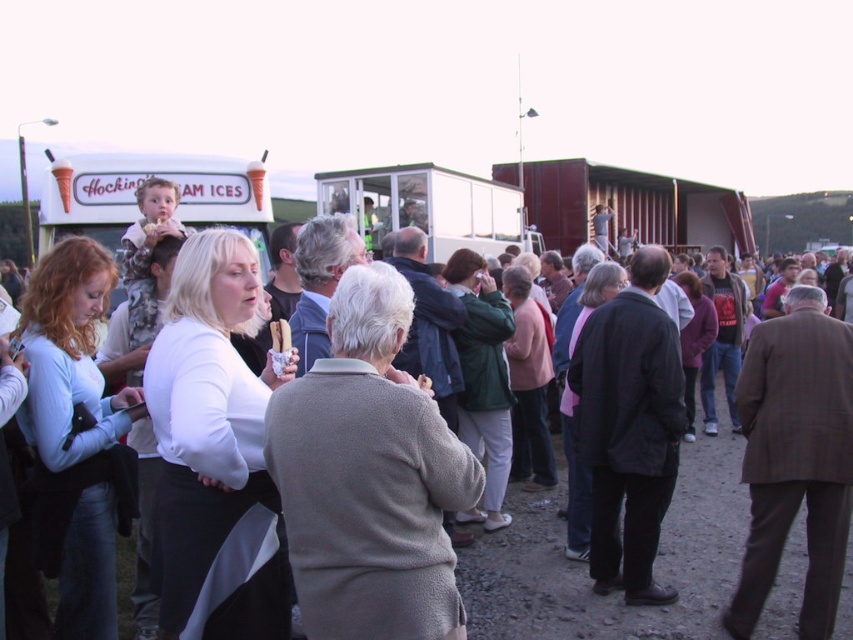
Based on the scene description, what is located at the coordinates point (585, 564)?

The white cotton shirt at center is located at point (585, 564).

You are standing at the entrance of the fair and see the white cotton shirt at center and the white plastic food truck at center. If you want to reach the food truck first, which object should you walk towards?

You should walk towards the white plastic food truck at center because it is closer to you than the white cotton shirt at center, which is 10.63 meters away.